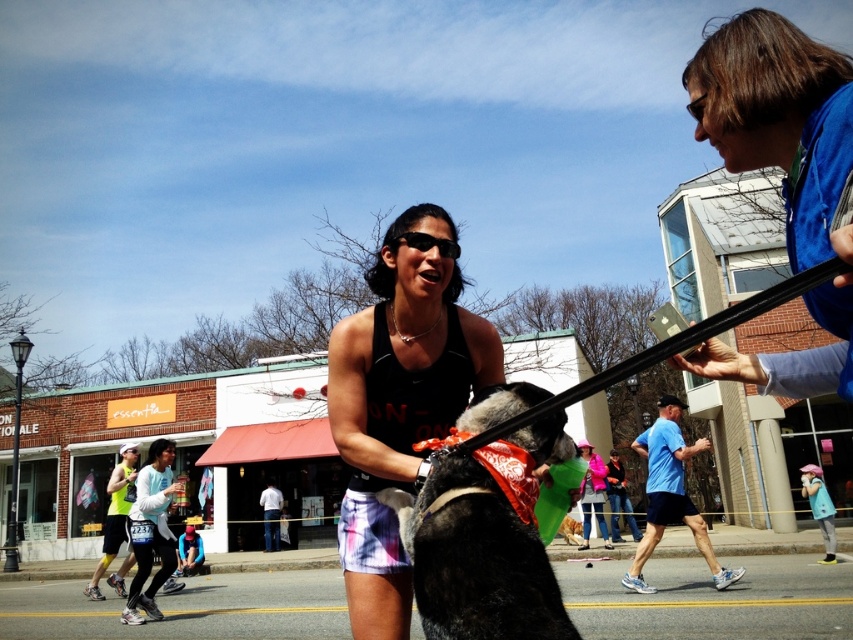
Where is the matte black tank top at center located in the image?

The matte black tank top at center is located at point (399, 401).

You are a photographer trying to capture a clear photo of both the matte black tank top at center and the black fur dog at center. Given that your camera has a depth of field that can focus on objects within a 15 inch range, will both subjects be in focus?

The matte black tank top at center and the black fur dog at center are 20.40 inches apart from each other. Since the distance between them exceeds the camera lens depth of field range of 15 inches, both subjects cannot be in focus simultaneously.

You are a photographer trying to capture a photo of the black fur dog at center without any distractions. Is the blue fabric at upper right positioned in a way that might block the dog in your shot?

The blue fabric at upper right is above the black fur dog at center, so it may block the top part of the dog in your photo unless you adjust your angle or position.